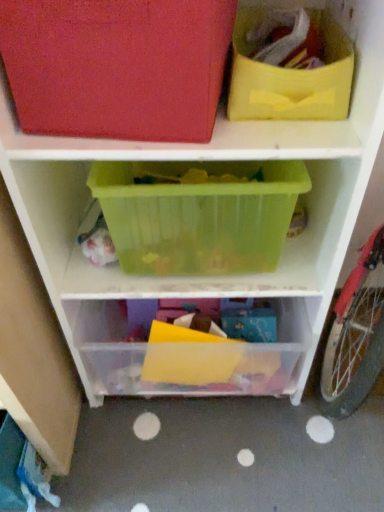
You are a GUI agent. You are given a task and a screenshot of the screen. Output one action in this format:
    pyautogui.click(x=<x>, y=<y>)
    Task: Click on the matte red storage bin at upper left, positioned as the third shelf in bottom-to-top order
    The height and width of the screenshot is (512, 384).
    Given the screenshot: What is the action you would take?
    pyautogui.click(x=245, y=122)

Image resolution: width=384 pixels, height=512 pixels. What are the coordinates of `transparent plastic container at center, arranged as the third shelf when viewed from the top` in the screenshot? It's located at (186, 356).

Based on their sizes in the image, would you say matte red storage bin at upper left, the 1th shelf when ordered from top to bottom, is bigger or smaller than translucent plastic container at center, the second shelf in the bottom-to-top sequence?

matte red storage bin at upper left, the 1th shelf when ordered from top to bottom, is smaller than translucent plastic container at center, the second shelf in the bottom-to-top sequence.

Considering the positions of point (358, 82) and point (315, 223), is point (358, 82) closer or farther from the camera than point (315, 223)?

Point (358, 82) is positioned closer to the camera compared to point (315, 223).

From the picture: Does matte red storage bin at upper left, the 1th shelf when ordered from top to bottom, lie in front of translucent plastic container at center, which appears as the 2th shelf when viewed from the top?

That is True.

From a real-world perspective, is matte red storage bin at upper left, positioned as the third shelf in bottom-to-top order, located beneath translucent plastic container at center, which appears as the 2th shelf when viewed from the top?

Incorrect, from a real-world perspective, matte red storage bin at upper left, positioned as the third shelf in bottom-to-top order, is higher than translucent plastic container at center, which appears as the 2th shelf when viewed from the top.

Measure the distance between matte red storage bin at upper left, the 1th shelf when ordered from top to bottom, and yellow fabric bag at upper right.

A distance of 3.20 inches exists between matte red storage bin at upper left, the 1th shelf when ordered from top to bottom, and yellow fabric bag at upper right.

Can you confirm if matte red storage bin at upper left, positioned as the third shelf in bottom-to-top order, is positioned to the left of yellow fabric bag at upper right?

Yes.

How different are the orientations of matte red storage bin at upper left, the 1th shelf when ordered from top to bottom, and yellow fabric bag at upper right in degrees?

0.000175 degrees.

In the scene shown: Can yellow fabric bag at upper right be found inside matte red storage bin at upper left, positioned as the third shelf in bottom-to-top order?

No, yellow fabric bag at upper right is not a part of matte red storage bin at upper left, positioned as the third shelf in bottom-to-top order.

Who is shorter, yellow fabric bag at upper right or transparent plastic container at center, placed as the first shelf when sorted from bottom to top?

yellow fabric bag at upper right.

Are yellow fabric bag at upper right and transparent plastic container at center, arranged as the third shelf when viewed from the top, beside each other?

No, yellow fabric bag at upper right is not making contact with transparent plastic container at center, arranged as the third shelf when viewed from the top.

Which of these two, yellow fabric bag at upper right or transparent plastic container at center, arranged as the third shelf when viewed from the top, is smaller?

With smaller size is yellow fabric bag at upper right.

Between yellow fabric bag at upper right and transparent plastic container at center, placed as the first shelf when sorted from bottom to top, which one has larger width?

With larger width is transparent plastic container at center, placed as the first shelf when sorted from bottom to top.

Considering the positions of objects translucent plastic container at center, which appears as the 2th shelf when viewed from the top, and matte red storage bin at upper left, positioned as the third shelf in bottom-to-top order, in the image provided, who is in front, translucent plastic container at center, which appears as the 2th shelf when viewed from the top, or matte red storage bin at upper left, positioned as the third shelf in bottom-to-top order,?

matte red storage bin at upper left, positioned as the third shelf in bottom-to-top order, is in front.

Looking at this image, from the image's perspective, does translucent plastic container at center, which appears as the 2th shelf when viewed from the top, appear lower than matte red storage bin at upper left, positioned as the third shelf in bottom-to-top order?

Indeed, from the image's perspective, translucent plastic container at center, which appears as the 2th shelf when viewed from the top, is shown beneath matte red storage bin at upper left, positioned as the third shelf in bottom-to-top order.

Does translucent plastic container at center, the second shelf in the bottom-to-top sequence, have a smaller size compared to matte red storage bin at upper left, the 1th shelf when ordered from top to bottom?

Incorrect, translucent plastic container at center, the second shelf in the bottom-to-top sequence, is not smaller in size than matte red storage bin at upper left, the 1th shelf when ordered from top to bottom.

Is matte red storage bin at upper left, positioned as the third shelf in bottom-to-top order, at the back of translucent plastic container at center, which appears as the 2th shelf when viewed from the top?

No.

Find the location of `storage box below the matte red storage bin at upper left, the 1th shelf when ordered from top to bottom (from a real-world perspective)`. storage box below the matte red storage bin at upper left, the 1th shelf when ordered from top to bottom (from a real-world perspective) is located at coordinates (290, 75).

Does yellow fabric bag at upper right have a lesser height compared to matte red storage bin at upper left, positioned as the third shelf in bottom-to-top order?

Indeed, yellow fabric bag at upper right has a lesser height compared to matte red storage bin at upper left, positioned as the third shelf in bottom-to-top order.

Is yellow fabric bag at upper right looking in the opposite direction of matte red storage bin at upper left, positioned as the third shelf in bottom-to-top order?

No, yellow fabric bag at upper right's orientation is not away from matte red storage bin at upper left, positioned as the third shelf in bottom-to-top order.

Which of these two, yellow fabric bag at upper right or translucent plastic container at center, the second shelf in the bottom-to-top sequence, is thinner?

Thinner between the two is yellow fabric bag at upper right.

Does point (344, 37) come in front of point (44, 234)?

Yes, it is in front of point (44, 234).

Could you tell me if transparent plastic container at center, placed as the first shelf when sorted from bottom to top, is turned towards translucent plastic container at center, the second shelf in the bottom-to-top sequence?

No, transparent plastic container at center, placed as the first shelf when sorted from bottom to top, is not aimed at translucent plastic container at center, the second shelf in the bottom-to-top sequence.

Who is shorter, transparent plastic container at center, arranged as the third shelf when viewed from the top, or translucent plastic container at center, the second shelf in the bottom-to-top sequence?

translucent plastic container at center, the second shelf in the bottom-to-top sequence.

Considering the relative sizes of transparent plastic container at center, arranged as the third shelf when viewed from the top, and translucent plastic container at center, the second shelf in the bottom-to-top sequence, in the image provided, is transparent plastic container at center, arranged as the third shelf when viewed from the top, bigger than translucent plastic container at center, the second shelf in the bottom-to-top sequence,?

Incorrect, transparent plastic container at center, arranged as the third shelf when viewed from the top, is not larger than translucent plastic container at center, the second shelf in the bottom-to-top sequence.

This screenshot has height=512, width=384. Identify the location of shelf that is the 1st one when counting forward from the transparent plastic container at center, arranged as the third shelf when viewed from the top. (177, 278).

This screenshot has width=384, height=512. Find the location of `the 1st shelf behind the matte red storage bin at upper left, positioned as the third shelf in bottom-to-top order`. the 1st shelf behind the matte red storage bin at upper left, positioned as the third shelf in bottom-to-top order is located at coordinates pos(177,278).

Identify the location of storage box that is below the matte red storage bin at upper left, positioned as the third shelf in bottom-to-top order (from the image's perspective). (290, 75).

When comparing their distances from translucent plastic container at center, the second shelf in the bottom-to-top sequence, does yellow fabric bag at upper right or matte red storage bin at upper left, the 1th shelf when ordered from top to bottom, seem further?

Among the two, yellow fabric bag at upper right is located further to translucent plastic container at center, the second shelf in the bottom-to-top sequence.

Estimate the real-world distances between objects in this image. Which object is further from transparent plastic container at center, placed as the first shelf when sorted from bottom to top, yellow fabric bag at upper right or matte red storage bin at upper left, the 1th shelf when ordered from top to bottom?

yellow fabric bag at upper right is positioned further to the anchor transparent plastic container at center, placed as the first shelf when sorted from bottom to top.

Looking at the image, which one is located closer to translucent plastic container at center, the second shelf in the bottom-to-top sequence, matte red storage bin at upper left, positioned as the third shelf in bottom-to-top order, or yellow fabric bag at upper right?

matte red storage bin at upper left, positioned as the third shelf in bottom-to-top order, is closer to translucent plastic container at center, the second shelf in the bottom-to-top sequence.

Looking at the image, which one is located closer to yellow fabric bag at upper right, matte red storage bin at upper left, positioned as the third shelf in bottom-to-top order, or transparent plastic container at center, placed as the first shelf when sorted from bottom to top?

matte red storage bin at upper left, positioned as the third shelf in bottom-to-top order, lies closer to yellow fabric bag at upper right than the other object.

Estimate the real-world distances between objects in this image. Which object is closer to matte red storage bin at upper left, the 1th shelf when ordered from top to bottom, transparent plastic container at center, placed as the first shelf when sorted from bottom to top, or translucent plastic container at center, which appears as the 2th shelf when viewed from the top?

Based on the image, translucent plastic container at center, which appears as the 2th shelf when viewed from the top, appears to be nearer to matte red storage bin at upper left, the 1th shelf when ordered from top to bottom.

From the image, which object appears to be farther from yellow fabric bag at upper right, transparent plastic container at center, placed as the first shelf when sorted from bottom to top, or translucent plastic container at center, which appears as the 2th shelf when viewed from the top?

Among the two, transparent plastic container at center, placed as the first shelf when sorted from bottom to top, is located further to yellow fabric bag at upper right.

Based on their spatial positions, is yellow fabric bag at upper right or transparent plastic container at center, arranged as the third shelf when viewed from the top, further from translucent plastic container at center, which appears as the 2th shelf when viewed from the top?

Among the two, yellow fabric bag at upper right is located further to translucent plastic container at center, which appears as the 2th shelf when viewed from the top.

Based on their spatial positions, is yellow fabric bag at upper right or transparent plastic container at center, placed as the first shelf when sorted from bottom to top, further from matte red storage bin at upper left, the 1th shelf when ordered from top to bottom?

Based on the image, transparent plastic container at center, placed as the first shelf when sorted from bottom to top, appears to be further to matte red storage bin at upper left, the 1th shelf when ordered from top to bottom.

Find the location of a particular element. The height and width of the screenshot is (512, 384). shelf between matte red storage bin at upper left, positioned as the third shelf in bottom-to-top order, and transparent plastic container at center, placed as the first shelf when sorted from bottom to top, vertically is located at coordinates (177, 278).

Where is `storage box between matte red storage bin at upper left, the 1th shelf when ordered from top to bottom, and transparent plastic container at center, placed as the first shelf when sorted from bottom to top, in the vertical direction`? The width and height of the screenshot is (384, 512). storage box between matte red storage bin at upper left, the 1th shelf when ordered from top to bottom, and transparent plastic container at center, placed as the first shelf when sorted from bottom to top, in the vertical direction is located at coordinates (290, 75).

I want to click on shelf between yellow fabric bag at upper right and transparent plastic container at center, placed as the first shelf when sorted from bottom to top, in the vertical direction, so click(177, 278).